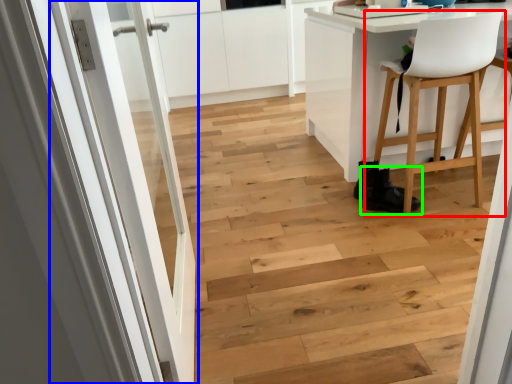
Question: Which is nearer to the chair (highlighted by a red box)? door (highlighted by a blue box) or footwear (highlighted by a green box).

Choices:
 (A) door
 (B) footwear

Answer: (B)